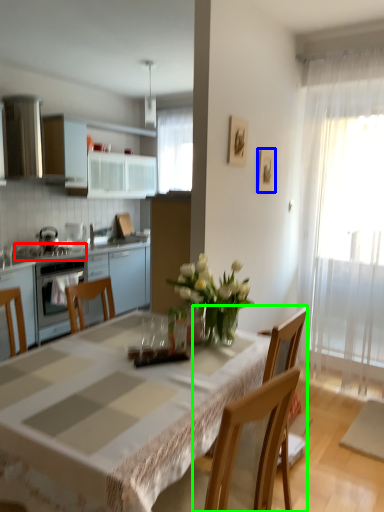
Question: Which object is positioned closest to gas stove (highlighted by a red box)? Select from picture frame (highlighted by a blue box) and chair (highlighted by a green box).

Choices:
 (A) picture frame
 (B) chair

Answer: (A)